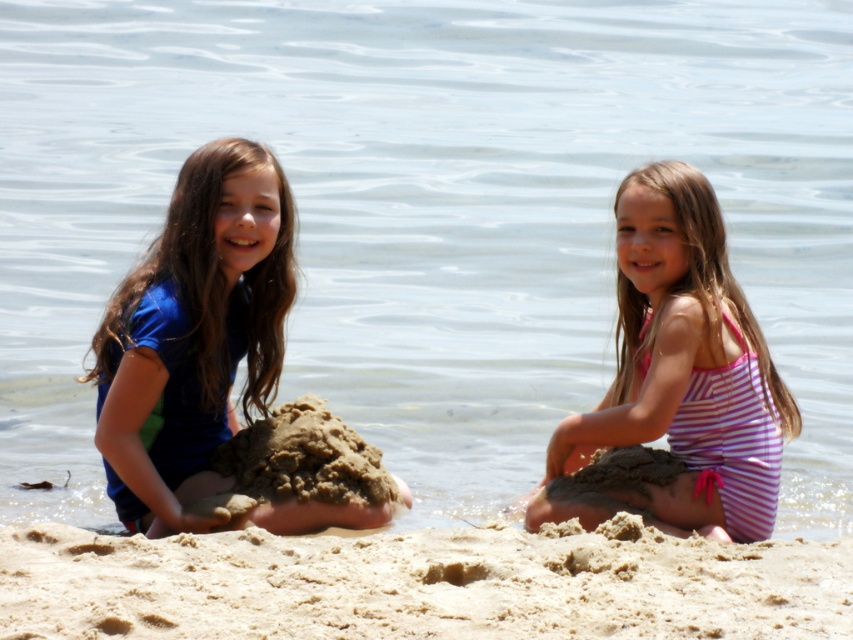
Looking at this image, between pink striped swimsuit at center and blue fabric swimsuit at left, which one appears on the right side from the viewer's perspective?

From the viewer's perspective, pink striped swimsuit at center appears more on the right side.

Does pink striped swimsuit at center appear on the right side of blue fabric swimsuit at left?

Yes, pink striped swimsuit at center is to the right of blue fabric swimsuit at left.

Does point (688, 492) come farther from viewer compared to point (238, 220)?

No, (688, 492) is in front of (238, 220).

Find the location of a particular element. Image resolution: width=853 pixels, height=640 pixels. pink striped swimsuit at center is located at coordinates (679, 376).

Does fine-grained sand at lower center have a smaller size compared to blue fabric swimsuit at left?

Actually, fine-grained sand at lower center might be larger than blue fabric swimsuit at left.

Between point (67, 554) and point (235, 173), which one is positioned behind?

The point (235, 173) is behind.

Locate an element on the screen. fine-grained sand at lower center is located at coordinates (421, 584).

Can you confirm if fine-grained sand at lower center is thinner than pink striped swimsuit at center?

Incorrect, fine-grained sand at lower center's width is not less than pink striped swimsuit at center's.

Between point (212, 564) and point (610, 502), which one is positioned behind?

Positioned behind is point (610, 502).

I want to click on fine-grained sand at lower center, so click(421, 584).